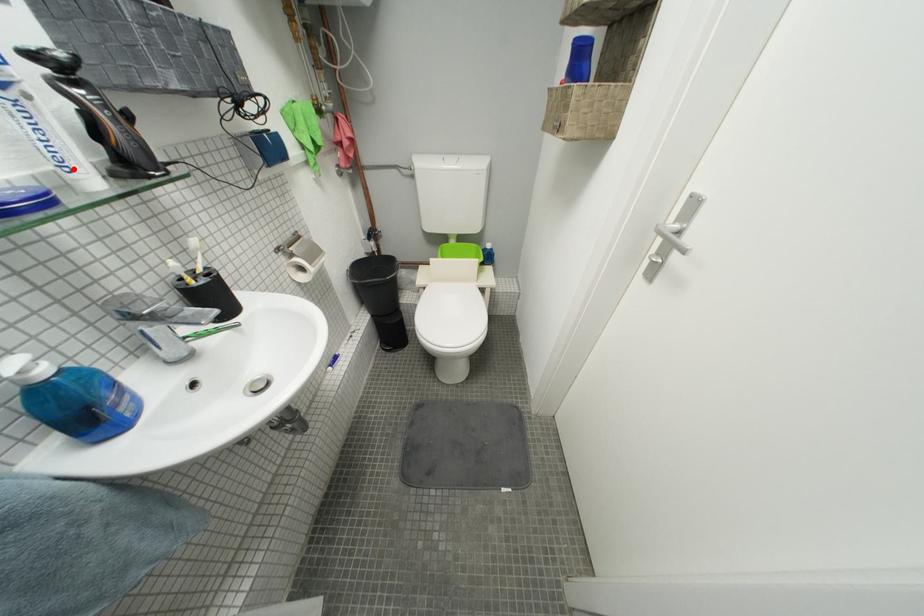
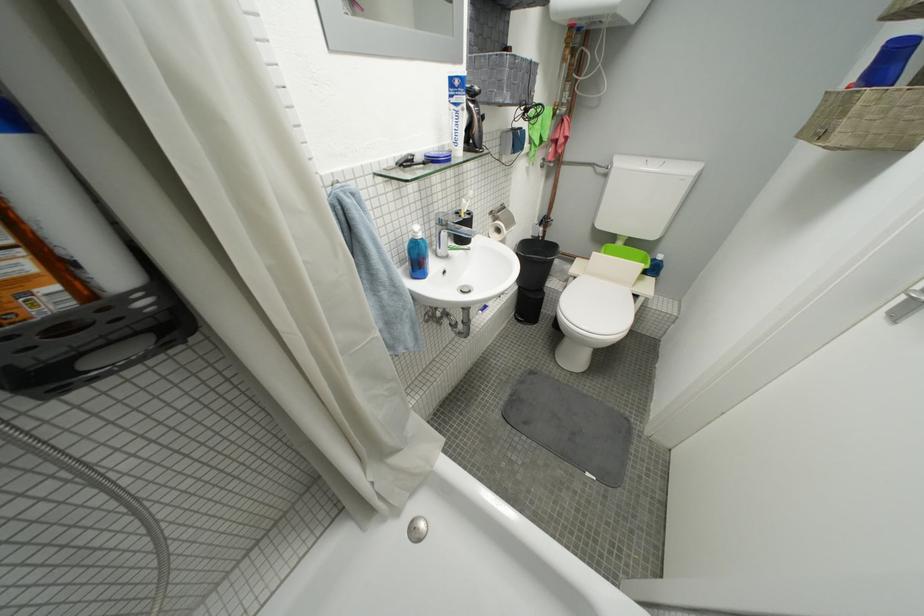
Find the pixel in the second image that matches the highlighted location in the first image.

(465, 145)